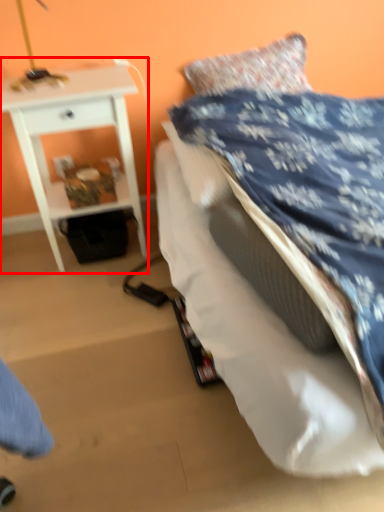
Question: From the image's perspective, what is the correct spatial positioning of nightstand (annotated by the red box) in reference to bed?

Choices:
 (A) below
 (B) above

Answer: (B)